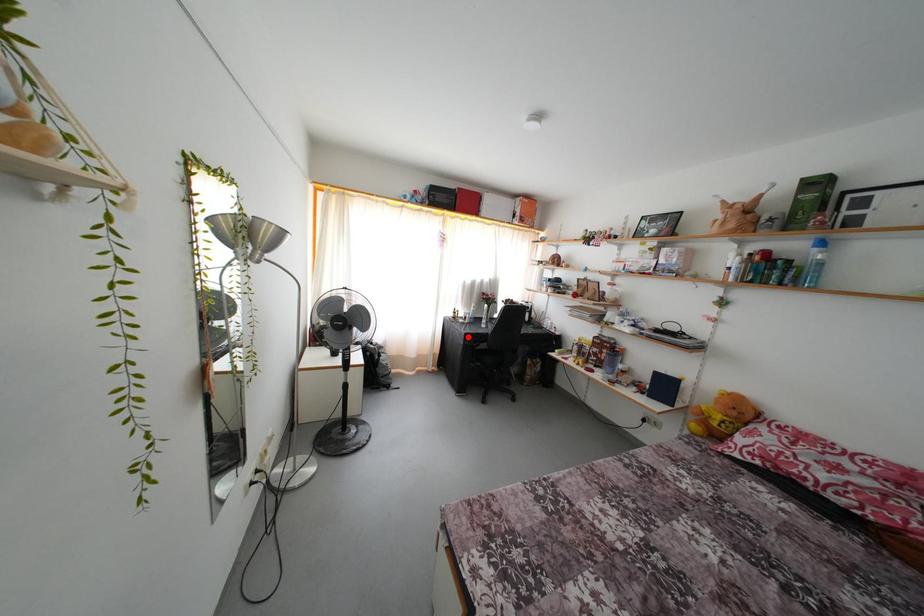
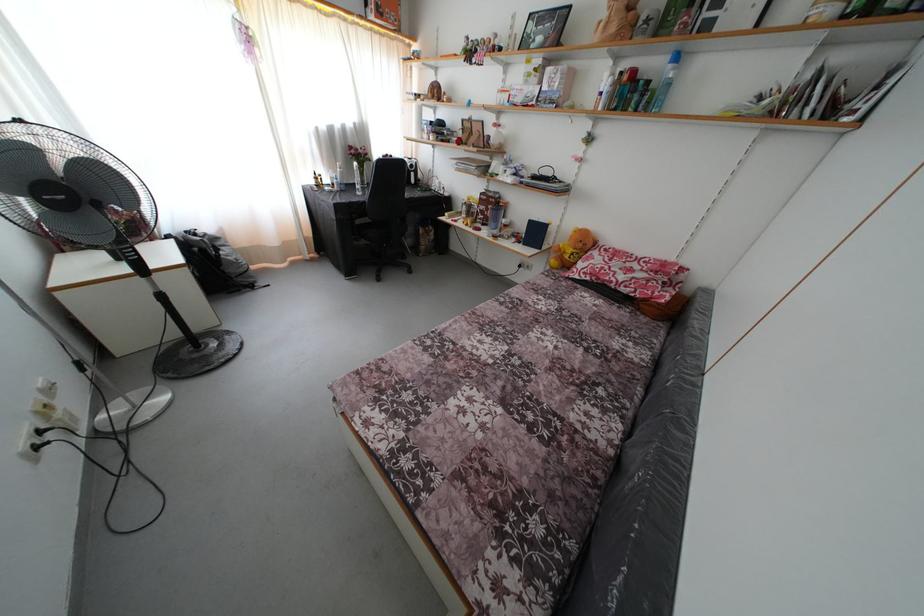
Find the pixel in the second image that matches the highlighted location in the first image.

(335, 207)